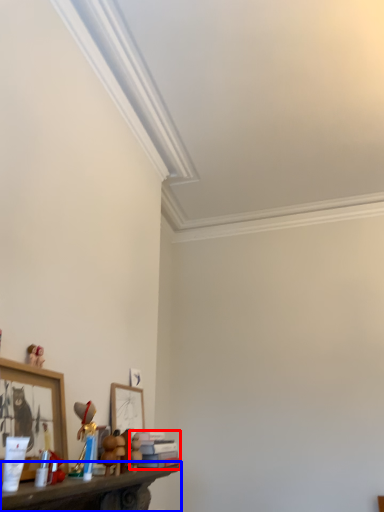
Question: Which point is further to the camera, book (highlighted by a red box) or shelf (highlighted by a blue box)?

Choices:
 (A) book
 (B) shelf

Answer: (A)